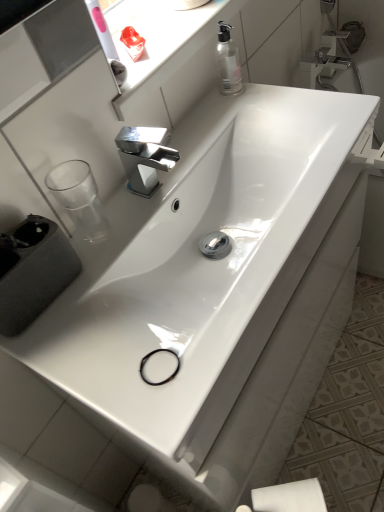
Locate an element on the screen. Image resolution: width=384 pixels, height=512 pixels. free spot to the left of polished chrome faucet at center is located at coordinates (112, 216).